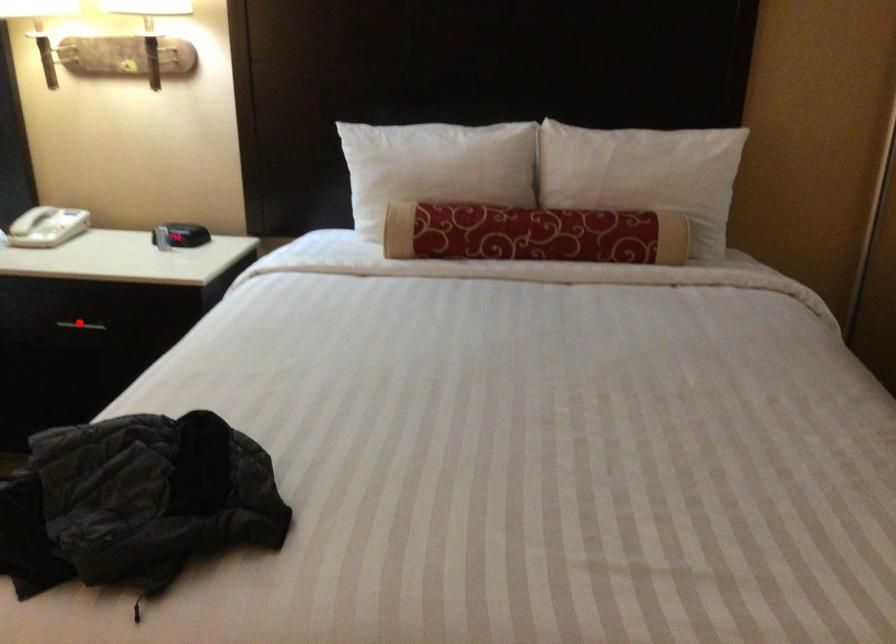
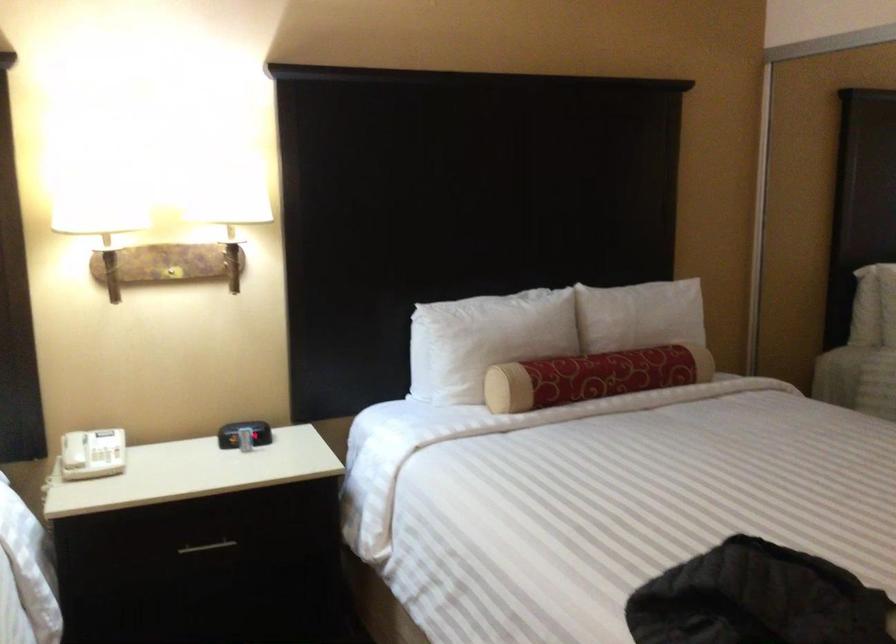
In the second image, find the point that corresponds to the highlighted location in the first image.

(207, 547)